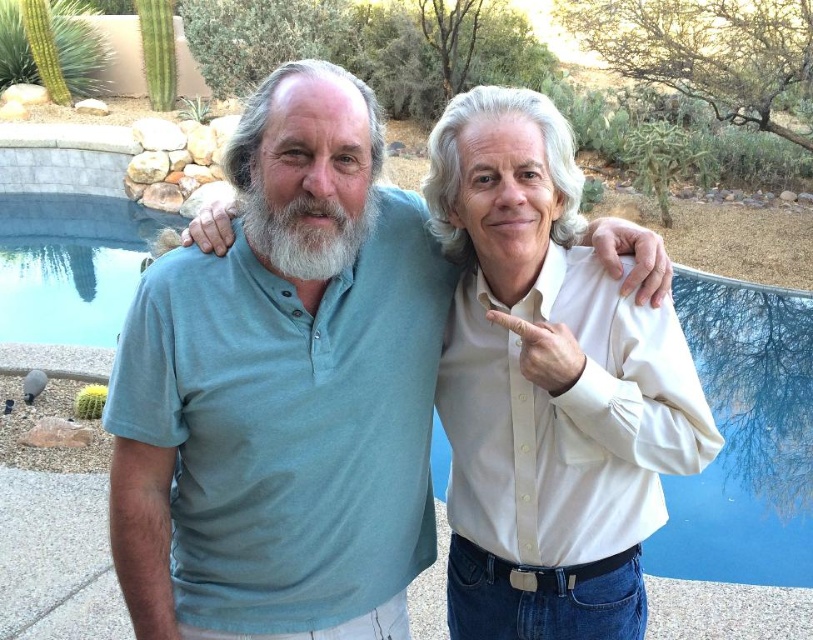
You are a photographer trying to capture the matte green shirt at center in the image. According to the coordinates provided, where should you focus your camera to ensure the shirt is centered in the frame?

You should focus your camera at the coordinates point (281, 401) to center the matte green shirt at center in the frame.

You are a photographer trying to capture a portrait of the matte green shirt at center and the white glossy shirt at right. Since you want to ensure both subjects are in focus, you need to know their vertical positions. Which shirt is higher up in the frame?

The matte green shirt at center is above the white glossy shirt at right, so it is higher up in the frame.